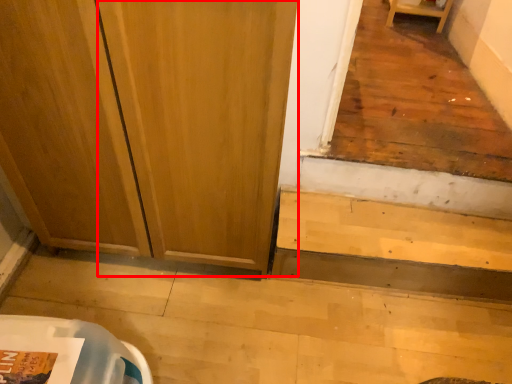
Question: From the image, what is the correct spatial relationship of screen door (annotated by the red box) in relation to stairwell?

Choices:
 (A) left
 (B) right

Answer: (A)